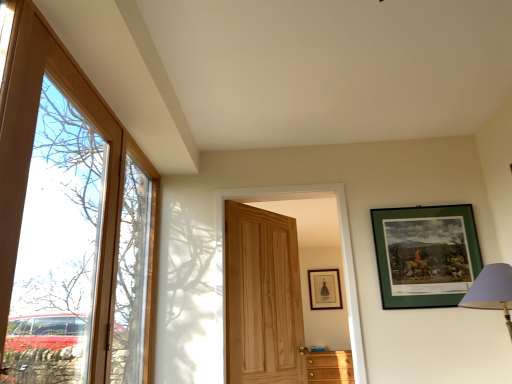
Question: From the image's perspective, relative to clear glass window at left, is matte black picture frame at upper center, the second picture frame positioned from the top, above or below?

Choices:
 (A) above
 (B) below

Answer: (B)

Question: Visually, is matte black picture frame at upper center, the second picture frame positioned from the top, positioned to the left or to the right of clear glass window at left?

Choices:
 (A) right
 (B) left

Answer: (A)

Question: Which is nearer to the wooden door at left, the first door viewed from the left?

Choices:
 (A) clear glass window at left
 (B) natural wood door at center, acting as the 1th door starting from the right
 (C) wooden cabinet at lower right
 (D) matte black picture frame at upper center, which is the first picture frame from back to front
 (E) green matte picture frame at upper right, arranged as the 1th picture frame when viewed from the front

Answer: (A)

Question: Based on their relative distances, which object is nearer to the wooden cabinet at lower right?

Choices:
 (A) green matte picture frame at upper right, arranged as the 1th picture frame when viewed from the front
 (B) natural wood door at center, the 2th door positioned from the front
 (C) clear glass window at left
 (D) wooden door at left, which ranks as the second door in right-to-left order
 (E) matte black picture frame at upper center, which is the first picture frame from back to front

Answer: (B)